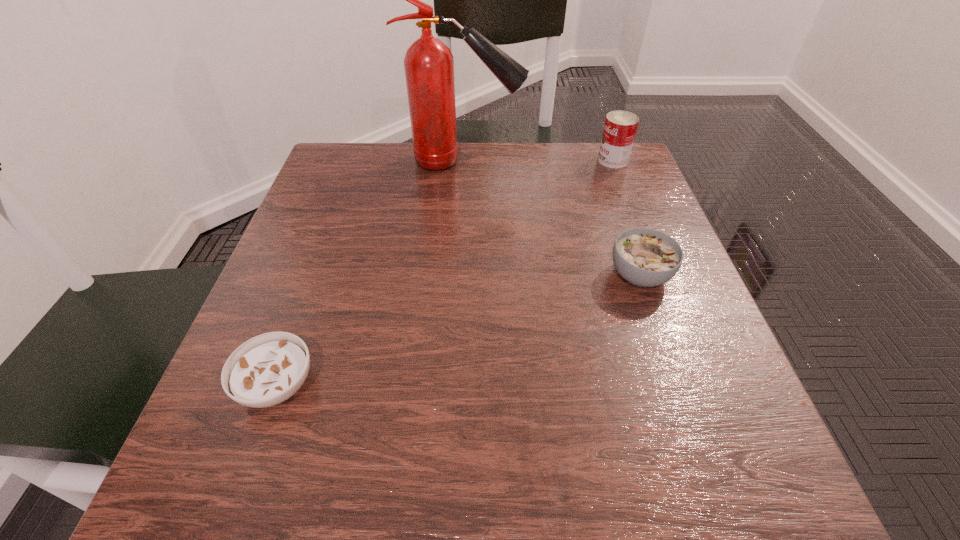
Find the location of `free spot located 0.270m on the front label of the second tallest object`. free spot located 0.270m on the front label of the second tallest object is located at coordinates (489, 160).

Locate an element on the screen. free spot located on the front of the right soup bowl is located at coordinates coord(694,430).

The image size is (960, 540). What are the coordinates of `vacant region located on the back of the shortest object` in the screenshot? It's located at 337,220.

Locate an element on the screen. fire extinguisher present at the far edge is located at coordinates (429, 64).

Where is `can located in the far edge section of the desktop`? The width and height of the screenshot is (960, 540). can located in the far edge section of the desktop is located at coordinates (620, 127).

Identify the location of object that is at the left edge. The image size is (960, 540). (266, 370).

Where is `can located at the right edge`? Image resolution: width=960 pixels, height=540 pixels. can located at the right edge is located at coordinates (620, 127).

Image resolution: width=960 pixels, height=540 pixels. I want to click on soup bowl that is positioned at the right edge, so click(645, 257).

Identify the location of object located in the far right corner section of the desktop. (620, 127).

At what (x,y) coordinates should I click in order to perform the action: click on vacant area at the far edge. Please return your answer as a coordinate pair (x, y). Looking at the image, I should click on (486, 184).